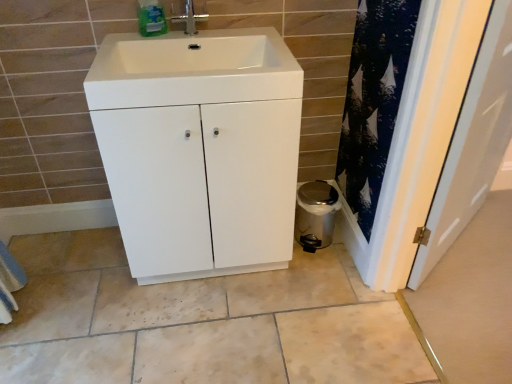
Locate an element on the screen. The height and width of the screenshot is (384, 512). vacant region in front of white matte cabinet at center is located at coordinates (222, 332).